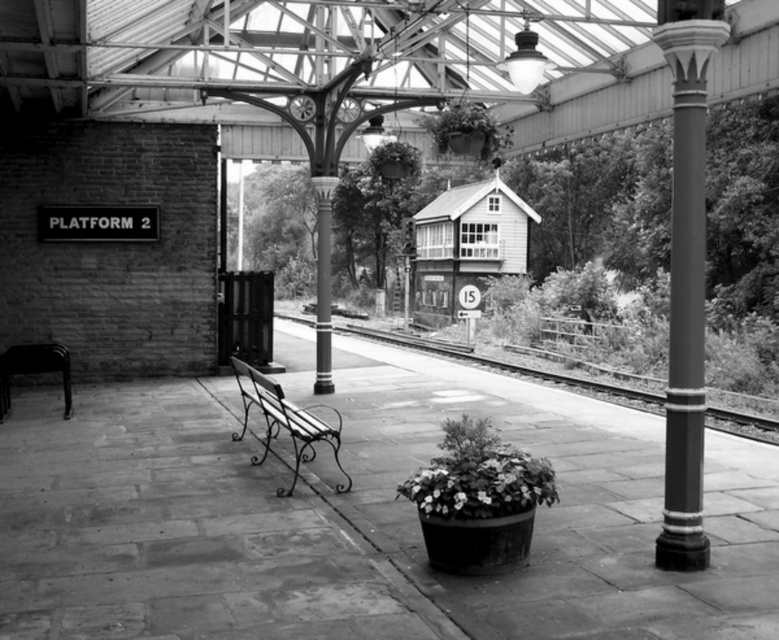
What is the position of the wooden signal box at center relative to the metal train track at center?

The wooden signal box at center is to the right of the metal train track at center.

You are a station engineer who needs to install a new device on the wooden signal box at center and the metal train track at center. The device requires a minimum of 2 meters of space around it to function properly. Based on the scene, can you determine if both locations have enough space?

The wooden signal box at center has a larger size compared to metal train track at center. Since the device requires 2 meters of space, the engineer must assess if both locations meet this requirement. However, without specific measurements of their sizes, it is impossible to confirm if the space is sufficient.